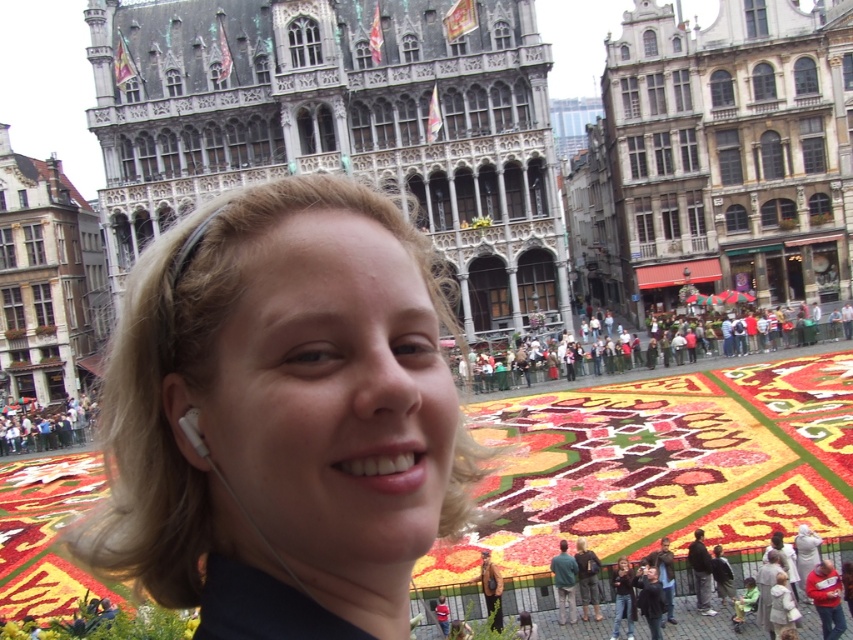
Question: In this image, where is dark gray stone building at upper center located relative to brown stone building at left?

Choices:
 (A) left
 (B) right

Answer: (B)

Question: Among these points, which one is farthest from the camera?

Choices:
 (A) (347, 4)
 (B) (195, 436)
 (C) (1, 170)
 (D) (335, 310)

Answer: (C)

Question: Considering the relative positions of dark gray stone building at upper center and white earphone at lower left in the image provided, where is dark gray stone building at upper center located with respect to white earphone at lower left?

Choices:
 (A) right
 (B) left

Answer: (B)

Question: Which point appears farthest from the camera in this image?

Choices:
 (A) tap(645, 42)
 (B) tap(12, 192)
 (C) tap(193, 420)

Answer: (B)

Question: Does blonde hair at center have a smaller size compared to white earphone at lower left?

Choices:
 (A) yes
 (B) no

Answer: (B)

Question: Which of these objects is positioned closest to the blonde hair at center?

Choices:
 (A) stone building at center
 (B) dark gray stone building at upper center
 (C) brown stone building at left
 (D) white earphone at lower left

Answer: (D)